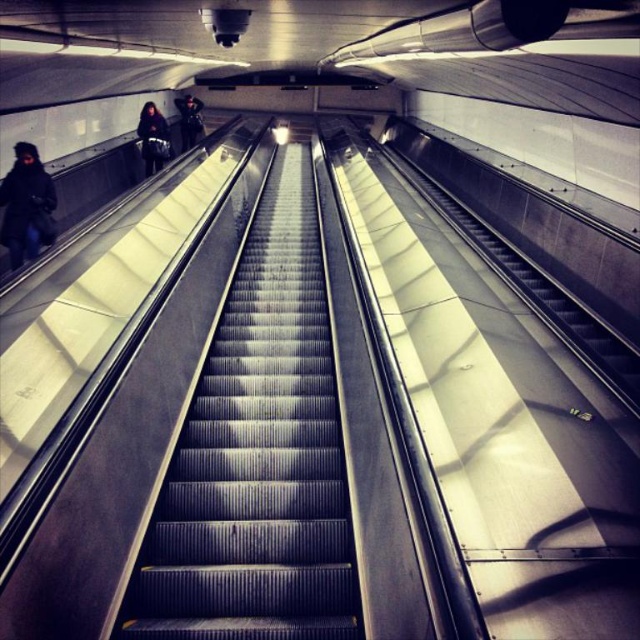
You are a security guard monitoring the escalator. You notice two items of clothing on the escalator steps. Which one is positioned more to the right side of the escalator? The dark blue fabric jacket at left or the dark gray fabric coat at upper left?

The dark blue fabric jacket at left is positioned more to the right side of the escalator compared to the dark gray fabric coat at upper left, as it is to the right of it.

You are a person standing at the bottom of the escalator and want to reach the top. There is a metallic gray stairs at center and a dark gray fabric coat at upper left in your view. Which object is higher from the ground?

The metallic gray stairs at center is taller than the dark gray fabric coat at upper left, so the metallic gray stairs at center is higher from the ground.